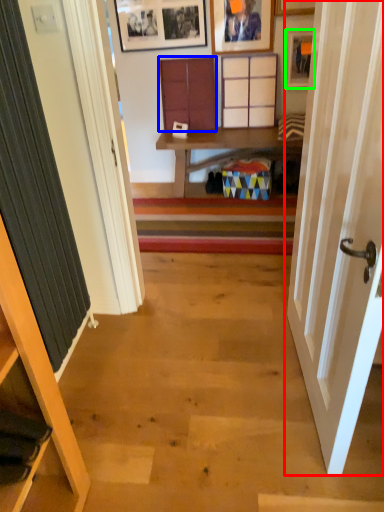
Question: Considering the real-world distances, which object is farthest from door (highlighted by a red box)? cabinet (highlighted by a blue box) or picture frame (highlighted by a green box)?

Choices:
 (A) cabinet
 (B) picture frame

Answer: (A)